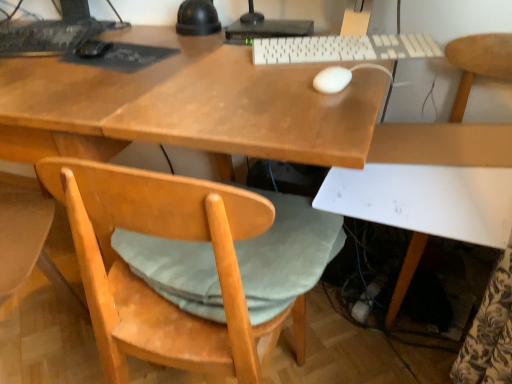
In order to click on free spot to the right of white matte mouse at center, the 1th mouse positioned from the bottom in this screenshot , I will do `click(369, 73)`.